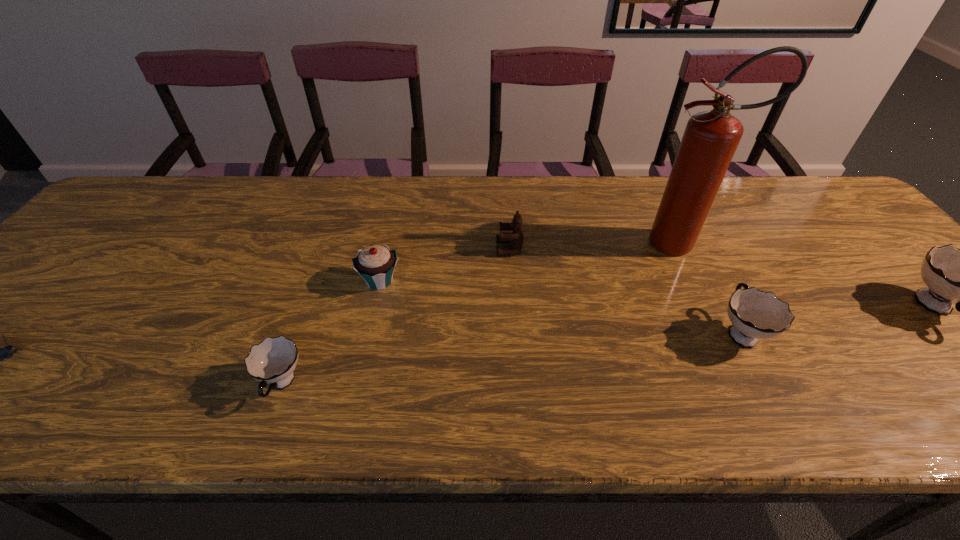
The height and width of the screenshot is (540, 960). I want to click on vacant space that satisfies the following two spatial constraints: 1. on the face of the teddy bear; 2. on the side of the second cup from left to right with the handle, so click(x=516, y=332).

Find the location of a particular element. The image size is (960, 540). free space that satisfies the following two spatial constraints: 1. on the face of the fourth object from left to right; 2. on the front side of the third object from left to right is located at coordinates (512, 281).

Where is `vacant space that satisfies the following two spatial constraints: 1. from the nozzle of the fire extinguisher; 2. on the side of the second shortest object with the handle`? vacant space that satisfies the following two spatial constraints: 1. from the nozzle of the fire extinguisher; 2. on the side of the second shortest object with the handle is located at coordinates (751, 384).